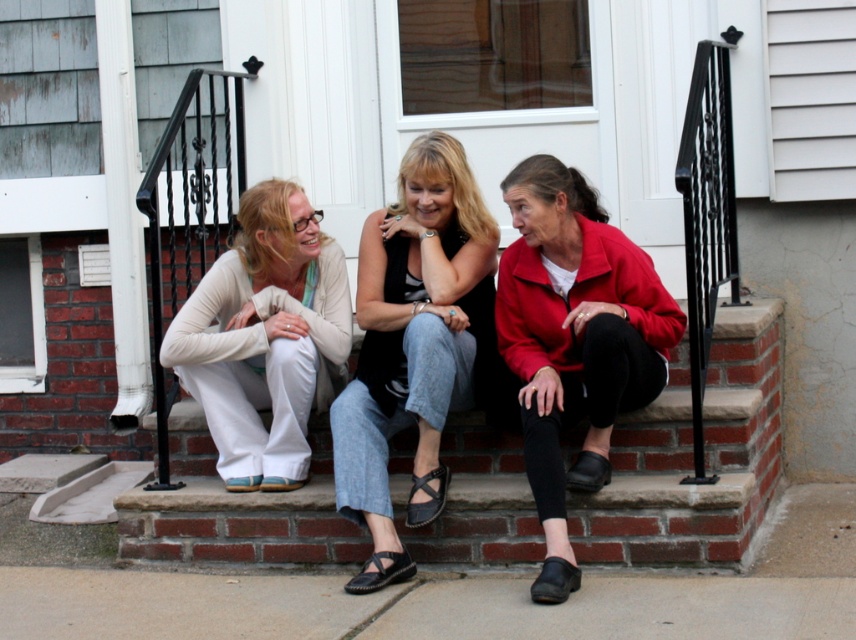
Question: Which object is farther from the camera taking this photo?

Choices:
 (A) smooth brick stairs at center
 (B) denim jeans at center
 (C) matte red jacket at center
 (D) matte white pants at center

Answer: (D)

Question: Can you confirm if smooth brick stairs at center is thinner than denim jeans at center?

Choices:
 (A) yes
 (B) no

Answer: (B)

Question: Can you confirm if smooth brick stairs at center is wider than denim jeans at center?

Choices:
 (A) no
 (B) yes

Answer: (B)

Question: Is smooth brick stairs at center to the right of denim jeans at center from the viewer's perspective?

Choices:
 (A) yes
 (B) no

Answer: (A)

Question: Which object appears closest to the camera in this image?

Choices:
 (A) matte red jacket at center
 (B) denim jeans at center

Answer: (A)

Question: Which point appears farthest from the camera in this image?

Choices:
 (A) (290, 230)
 (B) (432, 324)

Answer: (A)